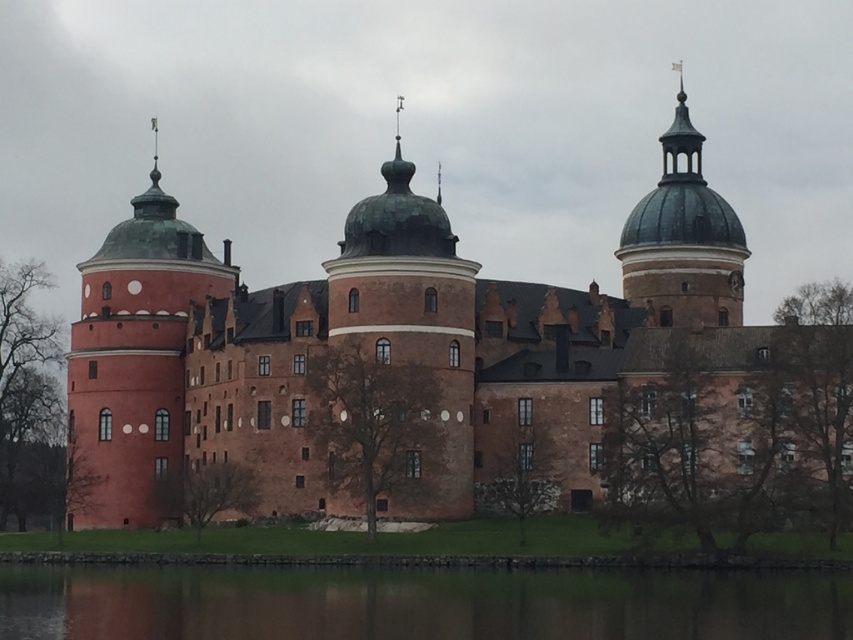
Image resolution: width=853 pixels, height=640 pixels. Describe the element at coordinates (135, 364) in the screenshot. I see `matte copper tower at left` at that location.

Locate an element on the screen. This screenshot has height=640, width=853. matte copper tower at left is located at coordinates (135, 364).

Where is `matte copper tower at left`? The image size is (853, 640). matte copper tower at left is located at coordinates (135, 364).

In the scene shown: Between green reflective water at lower center and green copper dome at upper right, which one has more height?

With more height is green copper dome at upper right.

Is green reflective water at lower center smaller than green copper dome at upper right?

Yes.

Consider the image. Who is more forward, (418, 598) or (685, 237)?

Point (418, 598) is more forward.

This screenshot has width=853, height=640. I want to click on green reflective water at lower center, so click(x=416, y=604).

Based on the photo, does rustic brick castle at center appear on the left side of green copper dome at upper right?

Correct, you'll find rustic brick castle at center to the left of green copper dome at upper right.

Does rustic brick castle at center have a smaller size compared to green copper dome at upper right?

Actually, rustic brick castle at center might be larger than green copper dome at upper right.

Describe the element at coordinates (386, 346) in the screenshot. The height and width of the screenshot is (640, 853). I see `rustic brick castle at center` at that location.

The height and width of the screenshot is (640, 853). I want to click on rustic brick castle at center, so click(x=386, y=346).